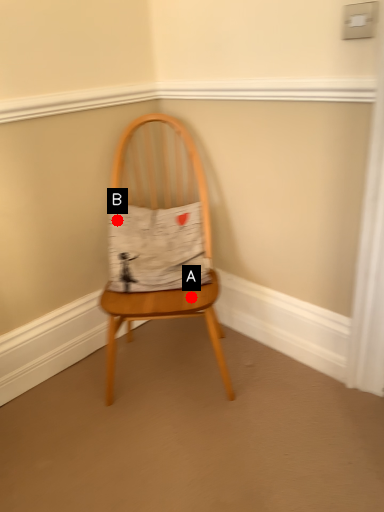
Question: Two points are circled on the image, labeled by A and B beside each circle. Among these points, which one is nearest to the camera?

Choices:
 (A) A is closer
 (B) B is closer

Answer: (A)